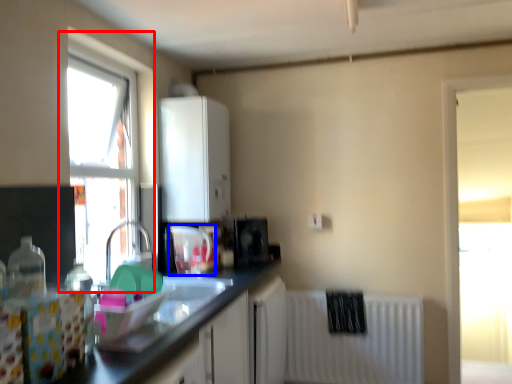
Question: Among these objects, which one is farthest to the camera, window (highlighted by a red box) or appliance (highlighted by a blue box)?

Choices:
 (A) window
 (B) appliance

Answer: (B)